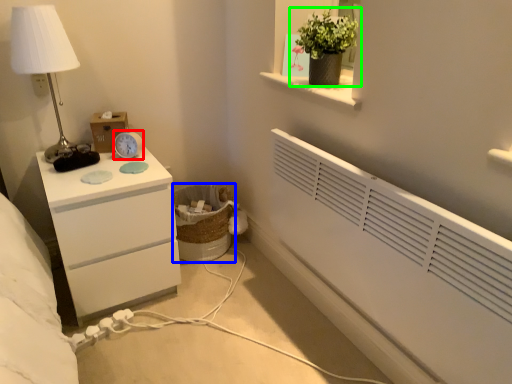
Question: Based on their relative distances, which object is farther from alarm clock (highlighted by a red box)? Choose from laundry basket (highlighted by a blue box) and houseplant (highlighted by a green box).

Choices:
 (A) laundry basket
 (B) houseplant

Answer: (B)